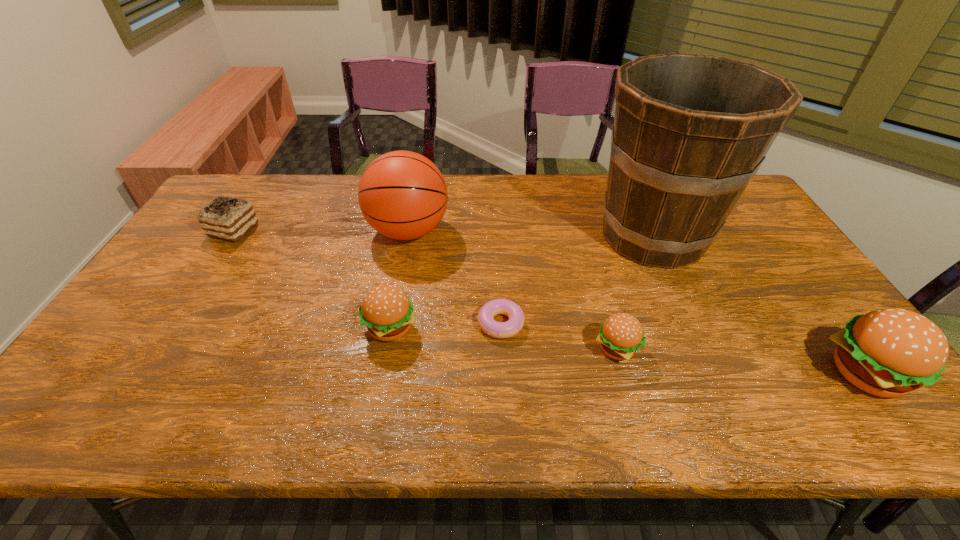
Please point a spot to add another hamburger on the left. Please provide its 2D coordinates. Your answer should be formatted as a tuple, i.e. [(x, y)], where the tuple contains the x and y coordinates of a point satisfying the conditions above.

[(182, 307)]